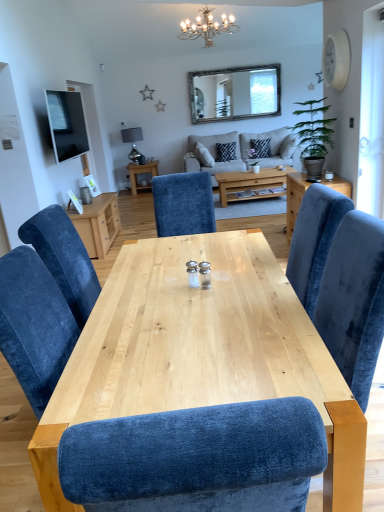
Locate an element on the screen. black textured pillow at center is located at coordinates (225, 152).

In order to face black textured pillow at center, should I rotate leftwards or rightwards?

Turn right by 4.712 degrees to look at black textured pillow at center.

Measure the distance between natural wood table at center, marked as the 2th table in a right-to-left arrangement, and camera.

natural wood table at center, marked as the 2th table in a right-to-left arrangement, is 3.48 feet away from camera.

This screenshot has width=384, height=512. What are the coordinates of `matte black tv at upper left` in the screenshot? It's located at (66, 124).

Locate an element on the screen. The height and width of the screenshot is (512, 384). white metallic chandelier at upper center is located at coordinates (207, 27).

This screenshot has width=384, height=512. What do you see at coordinates (249, 182) in the screenshot? I see `natural wood coffee table at center` at bounding box center [249, 182].

Find the location of `velvet blue chair at right, which is the second table in back-to-front order`. velvet blue chair at right, which is the second table in back-to-front order is located at coordinates (294, 198).

Locate an element on the screen. black textured pillow at center is located at coordinates (225, 152).

In the image, is matte black tv at upper left positioned in front of or behind natural wood coffee table at center?

Visually, matte black tv at upper left is located in front of natural wood coffee table at center.

How different are the orientations of matte black tv at upper left and natural wood coffee table at center in degrees?

86 degrees separate the facing orientations of matte black tv at upper left and natural wood coffee table at center.

Is matte black tv at upper left looking in the opposite direction of natural wood coffee table at center?

No.

Which object is positioned more to the left, matte black tv at upper left or natural wood coffee table at center?

Positioned to the left is matte black tv at upper left.

Is green leafy plant at right behind light wood table at center, which appears as the third table when viewed from the right?

No, it is in front of light wood table at center, which appears as the third table when viewed from the right.

Does point (320, 154) lie behind point (150, 161)?

No, it is in front of (150, 161).

Can you confirm if green leafy plant at right is positioned to the left of light wood table at center, acting as the 3th table starting from the front?

Incorrect, green leafy plant at right is not on the left side of light wood table at center, acting as the 3th table starting from the front.

Which of these two, velvet blue chair at right, which is the 3th table from left to right, or light gray fabric couch at center, is bigger?

light gray fabric couch at center is bigger.

Is velvet blue chair at right, marked as the 2th table in a bottom-to-top arrangement, positioned beyond the bounds of light gray fabric couch at center?

velvet blue chair at right, marked as the 2th table in a bottom-to-top arrangement, lies outside light gray fabric couch at center's area.

Which is behind, velvet blue chair at right, the 1th table viewed from the right, or light gray fabric couch at center?

Positioned behind is light gray fabric couch at center.

Is point (278, 141) closer or farther from the camera than point (148, 188)?

Clearly, point (278, 141) is closer to the camera than point (148, 188).

Who is more distant, light gray fabric couch at center or light wood table at center, which ranks as the 1th table in left-to-right order?

light wood table at center, which ranks as the 1th table in left-to-right order, is behind.

Which object is wider, light gray fabric couch at center or light wood table at center, acting as the 3th table starting from the front?

Wider between the two is light gray fabric couch at center.

Would you say light wood table at center, which is counted as the first table, starting from the top, is part of light gray fabric couch at center's contents?

No, light wood table at center, which is counted as the first table, starting from the top, is not inside light gray fabric couch at center.

Can you confirm if natural wood table at center, the first table positioned from the bottom, is wider than green leafy plant at right?

Correct, the width of natural wood table at center, the first table positioned from the bottom, exceeds that of green leafy plant at right.

Can you confirm if natural wood table at center, marked as the 2th table in a right-to-left arrangement, is positioned to the left of green leafy plant at right?

Indeed, natural wood table at center, marked as the 2th table in a right-to-left arrangement, is positioned on the left side of green leafy plant at right.

Based on the photo, does natural wood table at center, which appears as the third table when viewed from the back, touch green leafy plant at right?

No, natural wood table at center, which appears as the third table when viewed from the back, is not with green leafy plant at right.

Is natural wood table at center, the first table positioned from the bottom, inside the boundaries of green leafy plant at right, or outside?

natural wood table at center, the first table positioned from the bottom, is located beyond the bounds of green leafy plant at right.

Which table is the 2nd one when counting from the left side of the green leafy plant at right? Please provide its 2D coordinates.

[(142, 175)]

Which is more to the left, light wood table at center, positioned as the third table in bottom-to-top order, or green leafy plant at right?

Positioned to the left is light wood table at center, positioned as the third table in bottom-to-top order.

Considering the positions of point (145, 181) and point (316, 151), is point (145, 181) closer or farther from the camera than point (316, 151)?

Clearly, point (145, 181) is more distant from the camera than point (316, 151).

From a real-world perspective, is light wood table at center, which appears as the third table when viewed from the right, under green leafy plant at right?

Yes.

Looking at this image, is velvet blue chair at right, which is the 3th table from left to right, further to camera compared to natural wood table at center, the first table positioned from the bottom?

Yes, velvet blue chair at right, which is the 3th table from left to right, is behind natural wood table at center, the first table positioned from the bottom.

Does point (293, 205) appear closer or farther from the camera than point (241, 362)?

Point (293, 205) appears to be farther away from the viewer than point (241, 362).

Can you confirm if velvet blue chair at right, the 1th table viewed from the right, is smaller than natural wood table at center, the second table in the left-to-right sequence?

Indeed, velvet blue chair at right, the 1th table viewed from the right, has a smaller size compared to natural wood table at center, the second table in the left-to-right sequence.

Is natural wood table at center, the 3th table positioned from the top, located within velvet blue chair at right, which is the 3th table from left to right?

That's incorrect, natural wood table at center, the 3th table positioned from the top, is not inside velvet blue chair at right, which is the 3th table from left to right.

The width and height of the screenshot is (384, 512). In the image, there is a natural wood coffee table at center. Find the location of `television above it (from the image's perspective)`. television above it (from the image's perspective) is located at coordinates (66, 124).

The width and height of the screenshot is (384, 512). Identify the location of houseplant below the light wood table at center, which appears as the third table when viewed from the right (from the image's perspective). (314, 136).

From the image, which object appears to be nearer to velvet blue chair at right, the 1th table viewed from the right, wooden-framed mirror at upper center or light gray fabric couch at center?

light gray fabric couch at center lies closer to velvet blue chair at right, the 1th table viewed from the right, than the other object.

Estimate the real-world distances between objects in this image. Which object is further from natural wood coffee table at center, black textured pillow at center or green leafy plant at right?

Among the two, black textured pillow at center is located further to natural wood coffee table at center.

Which object lies nearer to the anchor point natural wood table at center, placed as the 1th table when sorted from front to back, white metallic chandelier at upper center or light wood table at center, which is counted as the first table, starting from the top?

Based on the image, white metallic chandelier at upper center appears to be nearer to natural wood table at center, placed as the 1th table when sorted from front to back.

Estimate the real-world distances between objects in this image. Which object is closer to light gray fabric couch at center, light wood table at center, which ranks as the 1th table in left-to-right order, or wooden-framed mirror at upper center?

wooden-framed mirror at upper center is closer to light gray fabric couch at center.

Which object lies nearer to the anchor point light wood table at center, which is counted as the first table, starting from the top, black textured pillow at center or white metallic chandelier at upper center?

black textured pillow at center is closer to light wood table at center, which is counted as the first table, starting from the top.

Based on their spatial positions, is natural wood coffee table at center or green leafy plant at right closer to velvet blue chair at right, the 1th table viewed from the right?

The object closer to velvet blue chair at right, the 1th table viewed from the right, is natural wood coffee table at center.

Which object lies further to the anchor point natural wood table at center, which appears as the third table when viewed from the back, white metallic chandelier at upper center or wooden-framed mirror at upper center?

wooden-framed mirror at upper center is positioned further to the anchor natural wood table at center, which appears as the third table when viewed from the back.

Considering their positions, is natural wood coffee table at center positioned further to light wood table at center, which ranks as the 1th table in left-to-right order, than velvet blue chair at right, the 2th table in the top-to-bottom sequence?

velvet blue chair at right, the 2th table in the top-to-bottom sequence, lies further to light wood table at center, which ranks as the 1th table in left-to-right order, than the other object.

Where is `houseplant between natural wood table at center, the 3th table positioned from the top, and light wood table at center, which is counted as the first table, starting from the top, from front to back`? houseplant between natural wood table at center, the 3th table positioned from the top, and light wood table at center, which is counted as the first table, starting from the top, from front to back is located at coordinates (314, 136).

Where is `studio couch that lies between wooden-framed mirror at upper center and natural wood coffee table at center from top to bottom`? studio couch that lies between wooden-framed mirror at upper center and natural wood coffee table at center from top to bottom is located at coordinates (240, 151).

Identify the location of pillow between wooden-framed mirror at upper center and light gray fabric couch at center vertically. (225, 152).

Image resolution: width=384 pixels, height=512 pixels. What are the coordinates of `television positioned between natural wood table at center, the second table in the left-to-right sequence, and light gray fabric couch at center from near to far` in the screenshot? It's located at (66, 124).